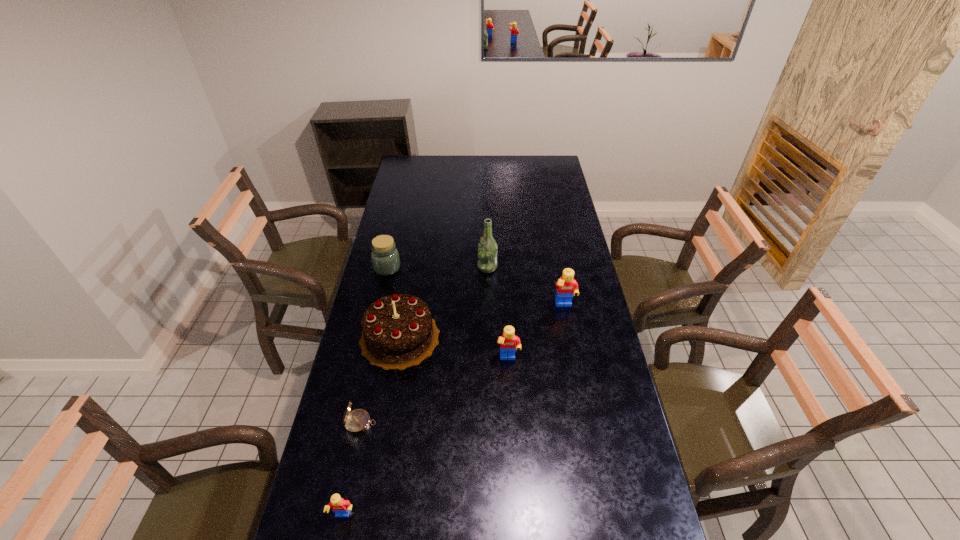
You are a GUI agent. You are given a task and a screenshot of the screen. Output one action in this format:
    pyautogui.click(x=<x>, y=<y>)
    Task: Click on the vacant point located between the farthest Lego and the compass
    
    Given the screenshot: What is the action you would take?
    pyautogui.click(x=462, y=364)

Image resolution: width=960 pixels, height=540 pixels. I want to click on free point between the jar and the farthest Lego, so click(476, 287).

Locate an element on the screen. This screenshot has width=960, height=540. empty space that is in between the second nearest Lego and the birthday cake is located at coordinates (454, 348).

Where is `free space that is in between the sixth farthest object and the second farthest Lego`? free space that is in between the sixth farthest object and the second farthest Lego is located at coordinates (434, 391).

In order to click on vacant region between the second shortest Lego and the leftmost Lego in this screenshot , I will do `click(425, 438)`.

Find the location of `free spot between the birthday cake and the sixth farthest object`. free spot between the birthday cake and the sixth farthest object is located at coordinates (379, 380).

In order to click on vacant space in between the birthday cake and the tallest object in this screenshot , I will do `click(444, 302)`.

Locate an element on the screen. The height and width of the screenshot is (540, 960). object that is the third closest to the beer bottle is located at coordinates (385, 258).

At what (x,y) coordinates should I click in order to perform the action: click on the third closest object to the jar. Please return your answer as a coordinate pair (x, y). The width and height of the screenshot is (960, 540). Looking at the image, I should click on (509, 343).

Image resolution: width=960 pixels, height=540 pixels. I want to click on Lego that can be found as the second closest to the second farthest Lego, so 341,507.